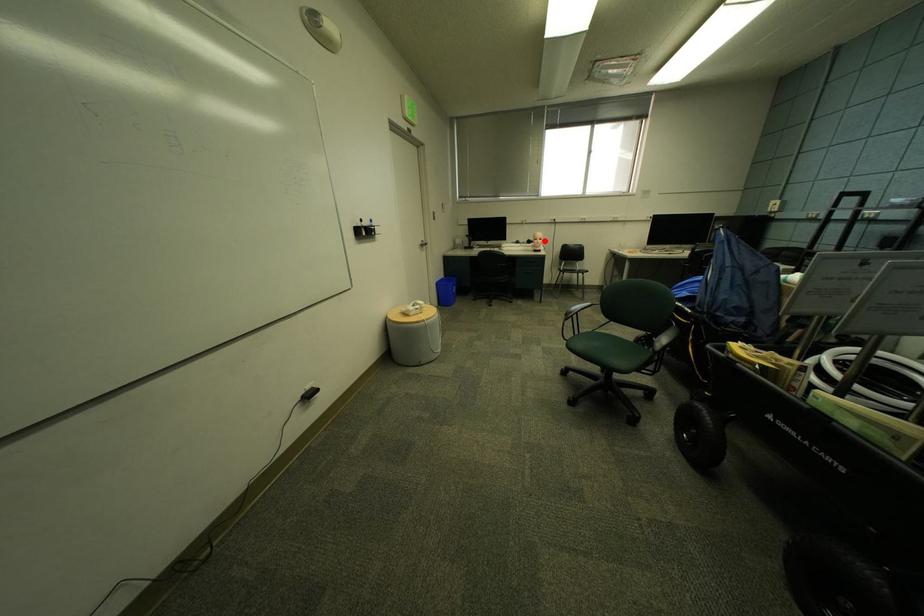
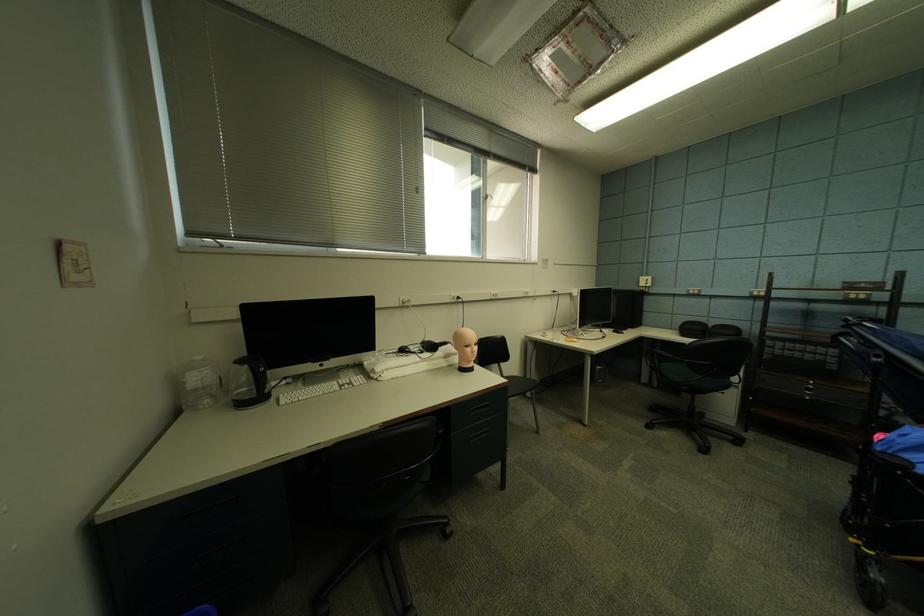
Find the pixel in the second image that matches the highlighted location in the first image.

(477, 347)